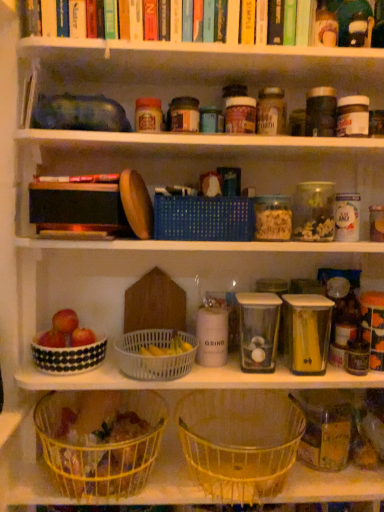
Question: Is white plastic basket at center, which appears as the 3th basket when ordered from the bottom, next to yellow wire basket at lower center, the first basket when ordered from bottom to top?

Choices:
 (A) yes
 (B) no

Answer: (B)

Question: Is white plastic basket at center, the 2th basket viewed from the top, facing away from yellow wire basket at lower center, which ranks as the 4th basket in top-to-bottom order?

Choices:
 (A) yes
 (B) no

Answer: (B)

Question: Does white plastic basket at center, which appears as the 3th basket when ordered from the bottom, have a larger size compared to yellow wire basket at lower center, which ranks as the 4th basket in top-to-bottom order?

Choices:
 (A) no
 (B) yes

Answer: (A)

Question: Can we say white plastic basket at center, the 2th basket viewed from the top, lies outside yellow wire basket at lower center, which ranks as the 4th basket in top-to-bottom order?

Choices:
 (A) no
 (B) yes

Answer: (B)

Question: Is white plastic basket at center, which appears as the 3th basket when ordered from the bottom, aimed at yellow wire basket at lower center, which ranks as the 4th basket in top-to-bottom order?

Choices:
 (A) yes
 (B) no

Answer: (B)

Question: Considering the positions of point (301, 224) and point (51, 420), is point (301, 224) closer or farther from the camera than point (51, 420)?

Choices:
 (A) farther
 (B) closer

Answer: (B)

Question: Looking at the image, does clear plastic container at upper right, which appears as the third glass jar when ordered from the bottom, seem bigger or smaller compared to yellow wire basket at lower center, which ranks as the 4th basket in top-to-bottom order?

Choices:
 (A) big
 (B) small

Answer: (B)

Question: Do you think clear plastic container at upper right, arranged as the 1th glass jar when viewed from the top, is within yellow wire basket at lower center, the first basket when ordered from bottom to top, or outside of it?

Choices:
 (A) outside
 (B) inside

Answer: (A)

Question: Considering the positions of clear plastic container at upper right, acting as the second glass jar starting from the right, and yellow wire basket at lower center, which ranks as the 4th basket in top-to-bottom order, in the image, is clear plastic container at upper right, acting as the second glass jar starting from the right, wider or thinner than yellow wire basket at lower center, which ranks as the 4th basket in top-to-bottom order,?

Choices:
 (A) thin
 (B) wide

Answer: (A)

Question: Is transparent plastic container at center, which is the third glass jar from right to left, inside or outside of yellow wire basket at lower center, which ranks as the 2th basket in bottom-to-top order?

Choices:
 (A) inside
 (B) outside

Answer: (B)

Question: Is transparent plastic container at center, marked as the 1th glass jar in a left-to-right arrangement, to the left or to the right of yellow wire basket at lower center, marked as the 3th basket in a top-to-bottom arrangement, in the image?

Choices:
 (A) left
 (B) right

Answer: (B)

Question: In terms of width, does transparent plastic container at center, the 2th glass jar when ordered from bottom to top, look wider or thinner when compared to yellow wire basket at lower center, which ranks as the 2th basket in bottom-to-top order?

Choices:
 (A) thin
 (B) wide

Answer: (A)

Question: From the image's perspective, is transparent plastic container at center, marked as the 1th glass jar in a left-to-right arrangement, positioned above or below yellow wire basket at lower center, marked as the 3th basket in a top-to-bottom arrangement?

Choices:
 (A) above
 (B) below

Answer: (A)

Question: Considering the relative positions of red matte apple at lower left, arranged as the 1th apple when viewed from the right, and yellow wire basket at lower center, marked as the 3th basket in a top-to-bottom arrangement, in the image provided, is red matte apple at lower left, arranged as the 1th apple when viewed from the right, to the left or to the right of yellow wire basket at lower center, marked as the 3th basket in a top-to-bottom arrangement,?

Choices:
 (A) left
 (B) right

Answer: (A)

Question: Is red matte apple at lower left, acting as the second apple starting from the left, taller or shorter than yellow wire basket at lower center, marked as the 3th basket in a top-to-bottom arrangement?

Choices:
 (A) tall
 (B) short

Answer: (B)